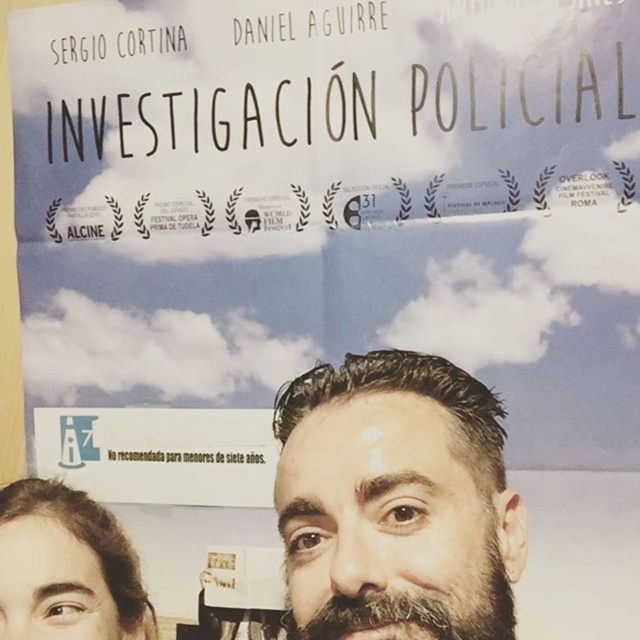
Question: Does brown hair at center appear under bearded man at lower left?

Choices:
 (A) no
 (B) yes

Answer: (A)

Question: Is brown hair at center in front of dark brown fuzzy beard at center?

Choices:
 (A) no
 (B) yes

Answer: (B)

Question: Which of the following is the closest to the observer?

Choices:
 (A) (10, 621)
 (B) (493, 576)

Answer: (B)

Question: Among these points, which one is farthest from the camera?

Choices:
 (A) (99, 512)
 (B) (300, 512)

Answer: (A)

Question: Is brown hair at center further to camera compared to bearded man at lower left?

Choices:
 (A) yes
 (B) no

Answer: (B)

Question: Which of the following is the farthest from the observer?

Choices:
 (A) bearded man at lower left
 (B) brown hair at center

Answer: (A)